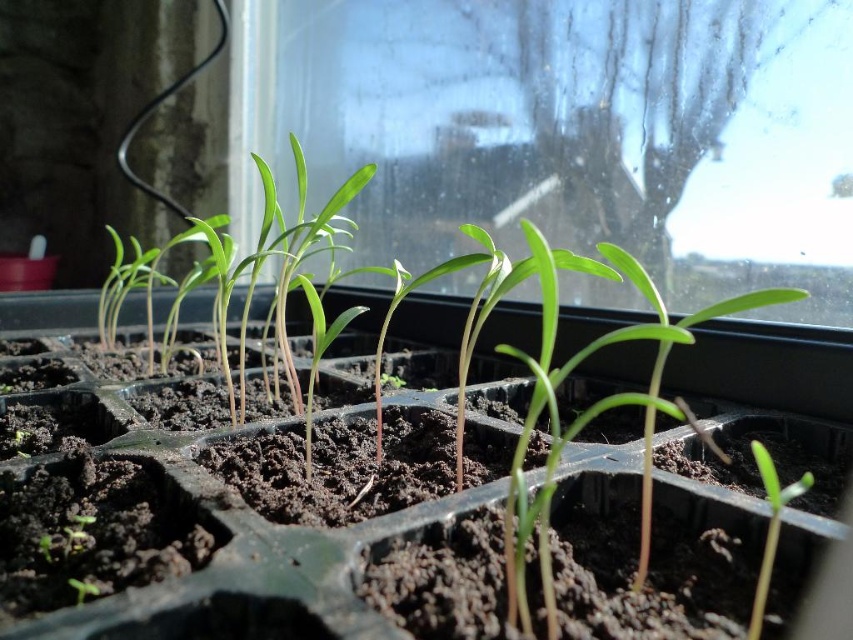
Question: Does transparent glass window at center have a greater width compared to green matte seedling at lower right?

Choices:
 (A) no
 (B) yes

Answer: (B)

Question: Considering the real-world distances, which object is closest to the green matte seedling at lower right?

Choices:
 (A) green plastic tray at center
 (B) transparent glass window at center

Answer: (A)

Question: Which point appears closest to the camera in this image?

Choices:
 (A) (776, 502)
 (B) (776, 342)
 (C) (334, 67)

Answer: (A)

Question: Which point is farther from the camera taking this photo?

Choices:
 (A) (845, 611)
 (B) (636, 33)
 (C) (799, 492)

Answer: (B)

Question: Does transparent glass window at center appear over green plastic tray at center?

Choices:
 (A) yes
 (B) no

Answer: (A)

Question: Can you confirm if green plastic tray at center is smaller than green matte seedling at lower right?

Choices:
 (A) no
 (B) yes

Answer: (A)